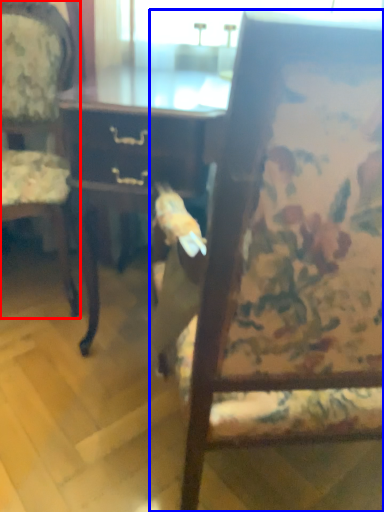
Question: Which object is closer to the camera taking this photo, chair (highlighted by a red box) or chair (highlighted by a blue box)?

Choices:
 (A) chair
 (B) chair

Answer: (B)